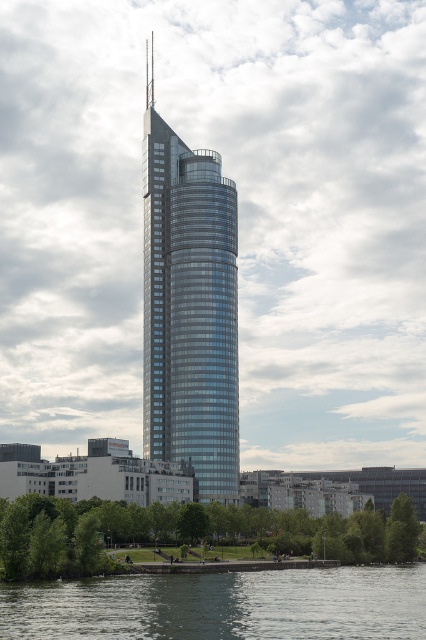
You are standing at the base of the skyscraper and want to take a photo that includes both the clear water at lower center and the green leafy tree at lower center. Which object should you focus on first to ensure both are in the frame?

Since the clear water at lower center is larger in size than the green leafy tree at lower center, you should focus on the clear water at lower center first as it occupies more space and will help frame the composition better.

You are standing in the park area near the water and want to take a photo of the skyscraper. There are two points marked on your map at coordinates point (351, 625) and point (54, 538). Which point should you go to if you want to be closer to the skyscraper?

You should go to point (351, 625) because it is closer to the viewer than point (54, 538), meaning it is nearer to your current position in the park area near the water.

You are a drone operator trying to capture a photo of the glassy steel tower at center and clear water at lower center. From your current position, can you see both objects simultaneously in your camera frame?

Yes, the glassy steel tower at center is above clear water at lower center, so they are positioned vertically in a way that allows both to be captured in the same frame.